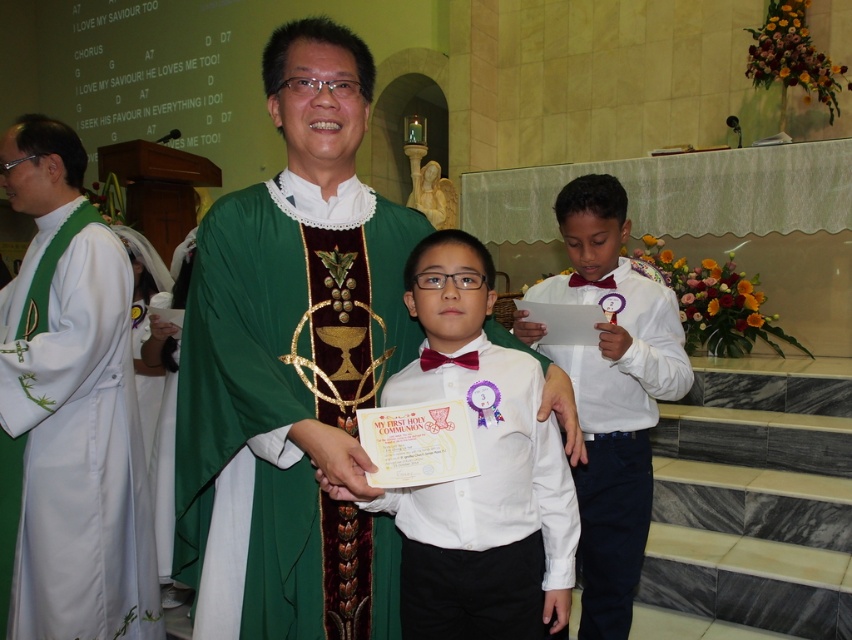
Question: Does green satin robe at center have a smaller size compared to white satin robe at right?

Choices:
 (A) no
 (B) yes

Answer: (A)

Question: Which of the following is the closest to the observer?

Choices:
 (A) (440, 288)
 (B) (338, 182)

Answer: (A)

Question: Is the position of white glossy shirt at center more distant than that of white satin robe at right?

Choices:
 (A) yes
 (B) no

Answer: (B)

Question: Which object is farther from the camera taking this photo?

Choices:
 (A) white satin robe at right
 (B) white silk robe at left

Answer: (B)

Question: Which point is farther to the camera?

Choices:
 (A) (642, 513)
 (B) (275, 636)
 (C) (462, 634)

Answer: (A)

Question: Does white silk robe at left lie behind white satin robe at right?

Choices:
 (A) yes
 (B) no

Answer: (A)